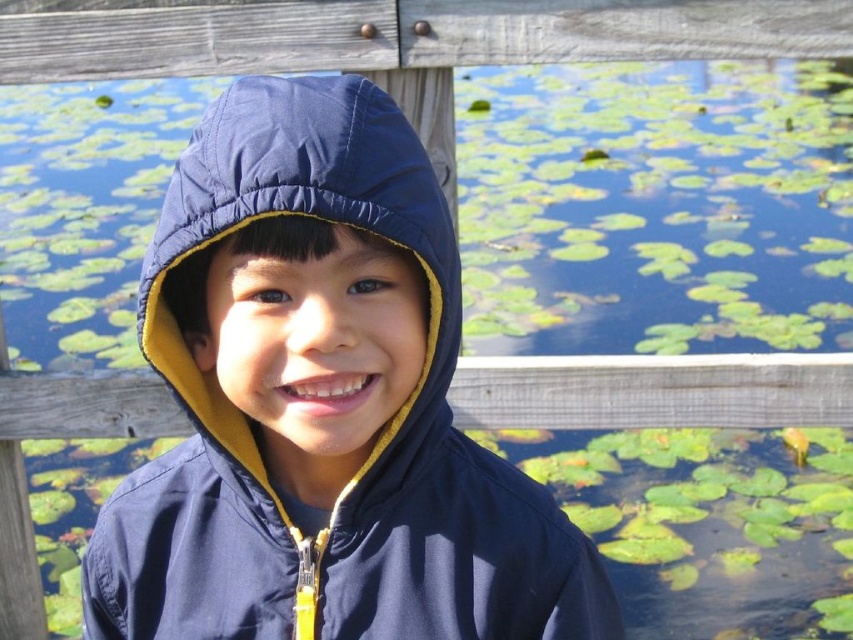
Question: Is navy blue jacket at center positioned at the back of navy blue quilted hood at center?

Choices:
 (A) no
 (B) yes

Answer: (B)

Question: Is navy blue jacket at center closer to camera compared to navy blue quilted hood at center?

Choices:
 (A) no
 (B) yes

Answer: (A)

Question: Which object is closer to the camera taking this photo?

Choices:
 (A) navy blue quilted hood at center
 (B) navy blue jacket at center

Answer: (A)

Question: Which point is closer to the camera?

Choices:
 (A) navy blue jacket at center
 (B) navy blue quilted hood at center

Answer: (B)

Question: Is navy blue jacket at center behind navy blue quilted hood at center?

Choices:
 (A) yes
 (B) no

Answer: (A)